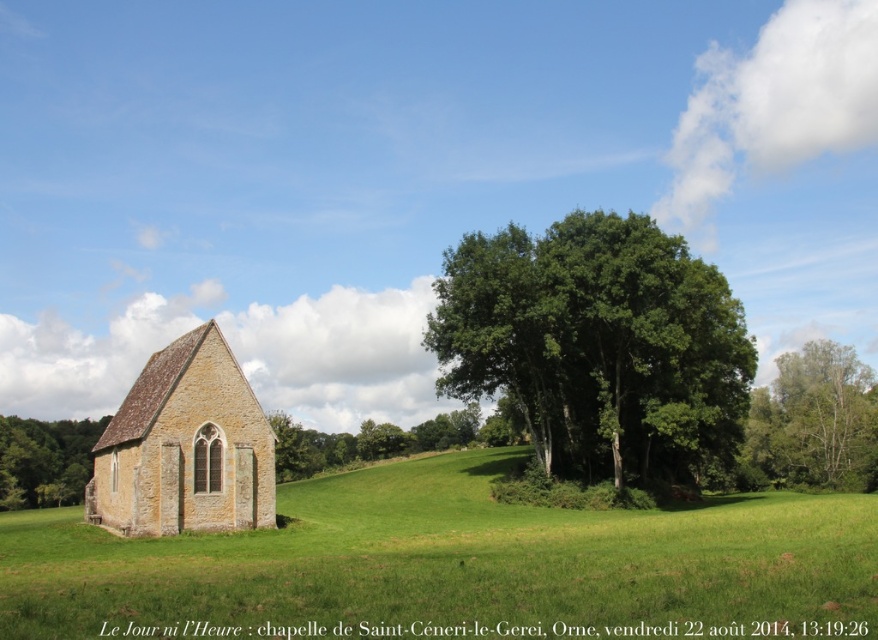
Question: Which object appears closest to the camera in this image?

Choices:
 (A) green leafy tree at center
 (B) green leafy tree at right
 (C) green leafy tree at lower left
 (D) green grassy field at lower left

Answer: (D)

Question: Observing the image, what is the correct spatial positioning of yellow stone church at left in reference to green leafy tree at right?

Choices:
 (A) right
 (B) left

Answer: (B)

Question: Among these objects, which one is farthest from the camera?

Choices:
 (A) green leafy tree at lower left
 (B) green grassy field at lower left
 (C) yellow stone church at left
 (D) green leafy tree at center

Answer: (A)

Question: Which point is closer to the camera?

Choices:
 (A) (814, 454)
 (B) (58, 452)

Answer: (A)

Question: Does yellow stone church at left have a lesser width compared to green leafy tree at lower left?

Choices:
 (A) yes
 (B) no

Answer: (A)

Question: Considering the relative positions of green grassy field at lower left and green leafy tree at right in the image provided, where is green grassy field at lower left located with respect to green leafy tree at right?

Choices:
 (A) right
 (B) left

Answer: (B)